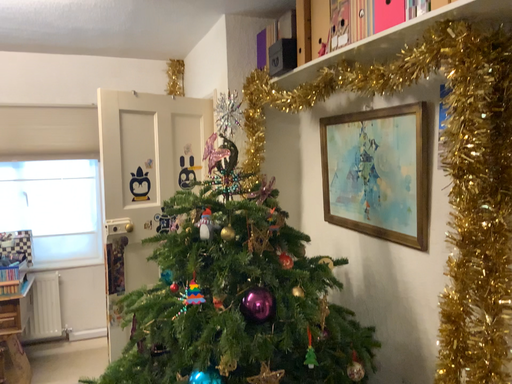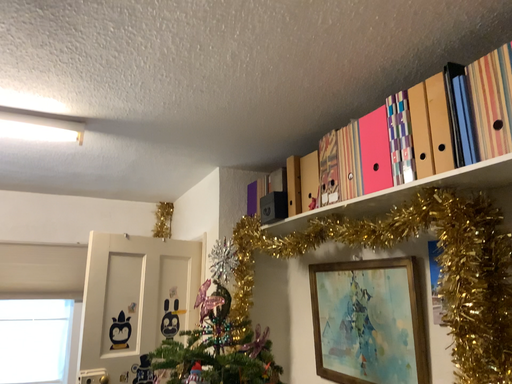
Question: How did the camera likely rotate when shooting the video?

Choices:
 (A) rotated upward
 (B) rotated downward

Answer: (A)